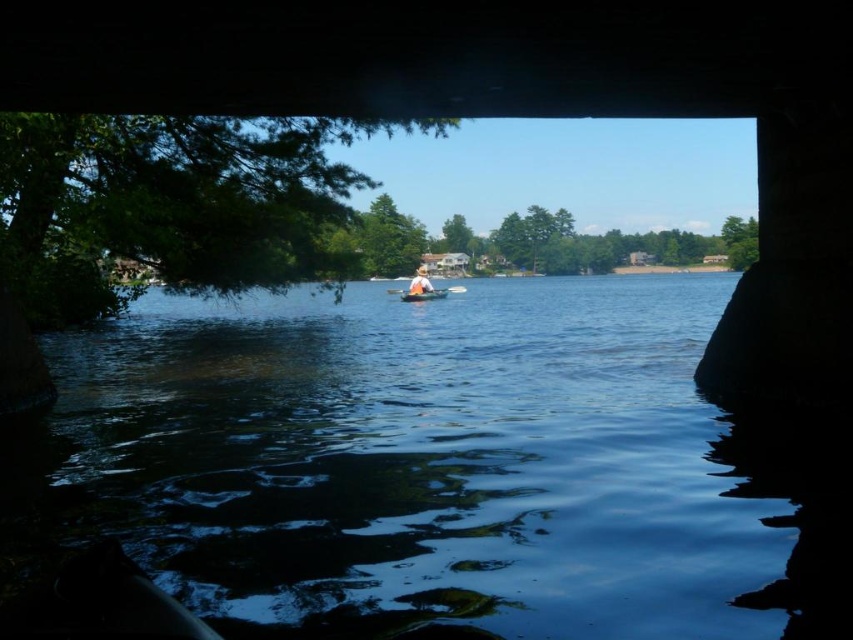
Question: Does orange fabric boat at center appear under orange plastic paddle at center?

Choices:
 (A) yes
 (B) no

Answer: (A)

Question: Is orange fabric boat at center behind orange plastic paddle at center?

Choices:
 (A) yes
 (B) no

Answer: (B)

Question: Which object is the farthest from the orange plastic paddle at center?

Choices:
 (A) orange fabric boat at center
 (B) white fabric hat at center
 (C) blue water at center

Answer: (C)

Question: Which of these objects is positioned closest to the orange fabric boat at center?

Choices:
 (A) white fabric hat at center
 (B) blue water at center
 (C) orange plastic paddle at center

Answer: (A)

Question: Which point is farther to the camera?

Choices:
 (A) white fabric hat at center
 (B) orange fabric boat at center
 (C) orange plastic paddle at center
 (D) blue water at center

Answer: (C)

Question: Does orange fabric boat at center have a smaller size compared to orange plastic paddle at center?

Choices:
 (A) yes
 (B) no

Answer: (A)